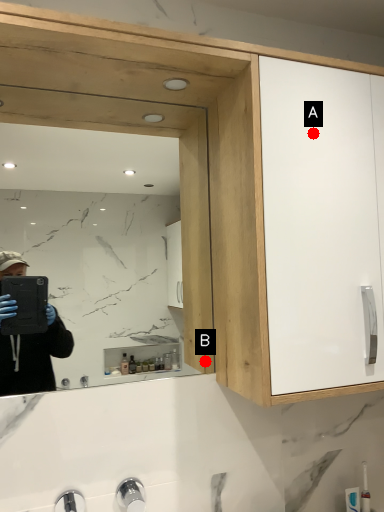
Question: Two points are circled on the image, labeled by A and B beside each circle. Which of the following is the farthest from the observer?

Choices:
 (A) A is further
 (B) B is further

Answer: (B)